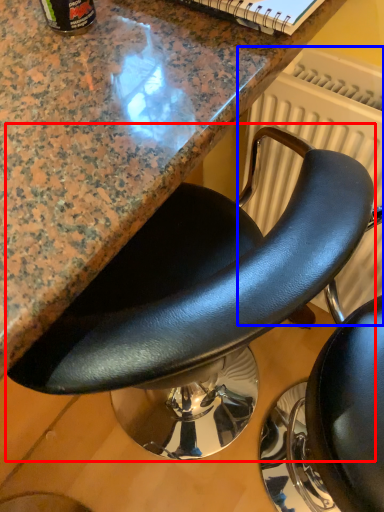
Question: Which point is closer to the camera, chair (highlighted by a red box) or radiator (highlighted by a blue box)?

Choices:
 (A) chair
 (B) radiator

Answer: (A)